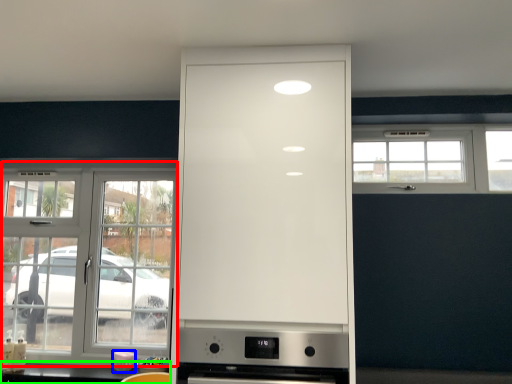
Question: Estimate the real-world distances between objects in this image. Which object is closer to window (highlighted by a red box), appliance (highlighted by a blue box) or counter top (highlighted by a green box)?

Choices:
 (A) appliance
 (B) counter top

Answer: (B)